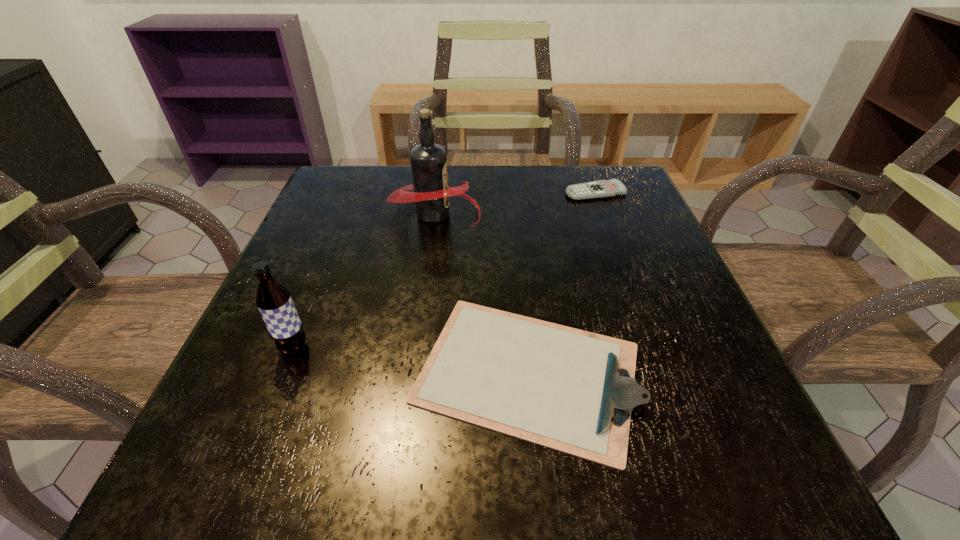
What are the coordinates of `root beer located in the far edge section of the desktop` in the screenshot? It's located at [x=431, y=194].

At what (x,y) coordinates should I click in order to perform the action: click on remote control that is positioned at the far edge. Please return your answer as a coordinate pair (x, y). Looking at the image, I should click on (599, 189).

Identify the location of object located at the near edge. This screenshot has width=960, height=540. click(x=567, y=389).

Identify the location of object situated at the left edge. Image resolution: width=960 pixels, height=540 pixels. (273, 299).

Find the location of a particular element. The width and height of the screenshot is (960, 540). clipboard positioned at the right edge is located at coordinates (567, 389).

Find the location of `remote control situated at the right edge`. remote control situated at the right edge is located at coordinates click(599, 189).

Identify the location of object that is positioned at the far right corner. (599, 189).

Find the location of a particular element. Image resolution: width=960 pixels, height=540 pixels. object present at the near right corner is located at coordinates (567, 389).

You are a GUI agent. You are given a task and a screenshot of the screen. Output one action in this format:
    pyautogui.click(x=<x>, y=<y>)
    Task: Click on the vacant space at the far edge of the desktop
    This screenshot has width=960, height=540.
    Given the screenshot: What is the action you would take?
    coord(481,206)

Find the location of `vacant area at the near edge of the desktop`. vacant area at the near edge of the desktop is located at coordinates (369, 471).